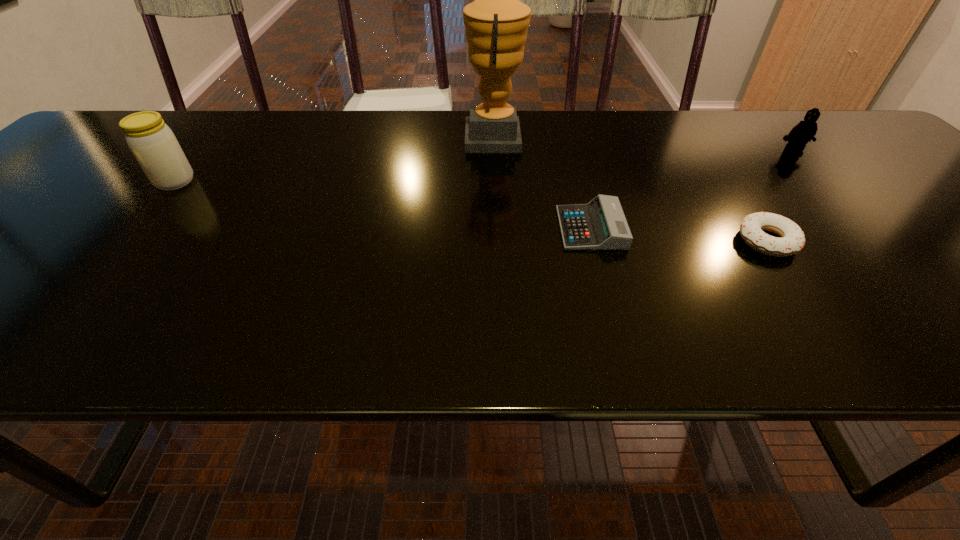
This screenshot has width=960, height=540. I want to click on the fourth object from right to left, so click(x=496, y=23).

This screenshot has height=540, width=960. I want to click on award, so click(x=496, y=23).

Where is `the fourth shortest object`? This screenshot has height=540, width=960. the fourth shortest object is located at coordinates (154, 145).

At what (x,y) coordinates should I click in order to perform the action: click on the leftmost object. Please return your answer as a coordinate pair (x, y). This screenshot has width=960, height=540. Looking at the image, I should click on (154, 145).

Where is `Lego`? This screenshot has height=540, width=960. Lego is located at coordinates click(x=804, y=131).

Locate an element on the screen. The width and height of the screenshot is (960, 540). the rightmost object is located at coordinates (804, 131).

Where is `doughnut`? The image size is (960, 540). doughnut is located at coordinates (792, 240).

The height and width of the screenshot is (540, 960). I want to click on the third object from left to right, so click(x=601, y=224).

You are a GUI agent. You are given a task and a screenshot of the screen. Output one action in this format:
    pyautogui.click(x=<x>, y=<y>)
    Task: Click on the vacant area situated at the front of the tallest object with handles
    
    Given the screenshot: What is the action you would take?
    pyautogui.click(x=331, y=138)

Image resolution: width=960 pixels, height=540 pixels. In order to click on free space located 0.180m at the front of the tallest object with handles in this screenshot , I will do `click(396, 138)`.